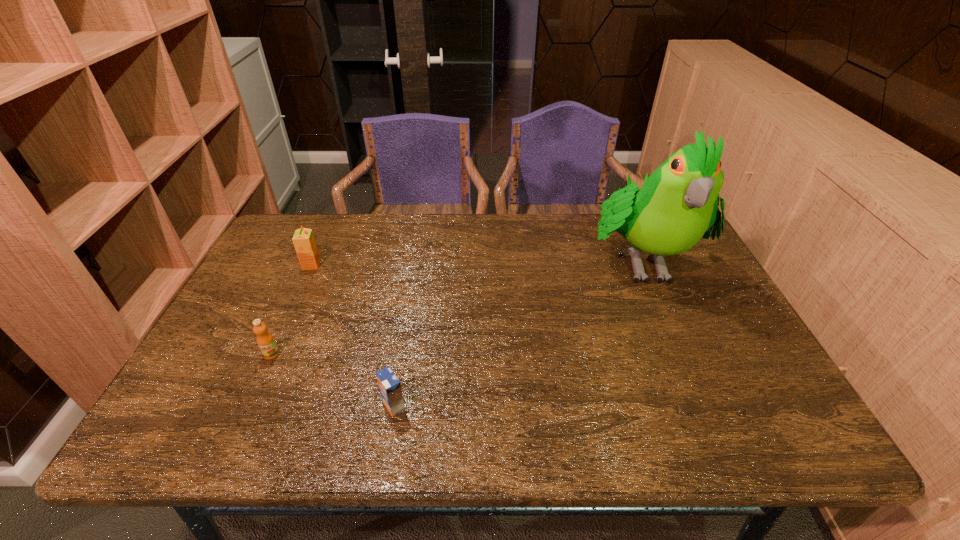
Where is `the rightmost object`? the rightmost object is located at coordinates coord(678,203).

Locate an element on the screen. The image size is (960, 540). the tallest object is located at coordinates (678, 203).

I want to click on the farthest orange_juice, so click(x=304, y=242).

Identify the location of the third farthest object. The width and height of the screenshot is (960, 540). (265, 340).

Locate an element on the screen. The image size is (960, 540). the rightmost orange_juice is located at coordinates click(389, 385).

The height and width of the screenshot is (540, 960). Find the location of `the second object from right to left`. the second object from right to left is located at coordinates (389, 385).

This screenshot has width=960, height=540. I want to click on blank area located 0.340m on the beak of the parakeet, so (x=714, y=427).

This screenshot has width=960, height=540. I want to click on free space located 0.240m on the right of the farthest orange_juice, so click(400, 265).

You are a GUI agent. You are given a task and a screenshot of the screen. Output one action in this format:
    pyautogui.click(x=<x>, y=<y>)
    Task: Click on the free space located 0.200m on the front label of the second farthest orange_juice
    The image size is (960, 540).
    Given the screenshot: What is the action you would take?
    coord(234,438)

The width and height of the screenshot is (960, 540). Find the location of `vacant space located on the back of the nearest object`. vacant space located on the back of the nearest object is located at coordinates (404, 346).